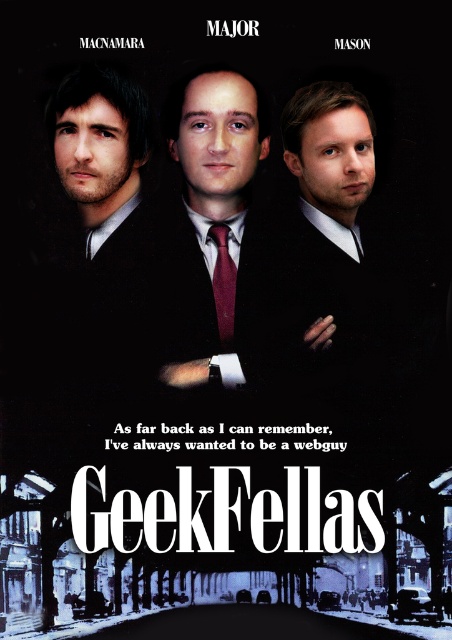
Between matte black suit at center and maroon satin tie at center, which one has more height?

matte black suit at center is taller.

Is matte black suit at center taller than maroon satin tie at center?

Yes.

Where is `matte black suit at center`? The image size is (452, 640). matte black suit at center is located at coordinates (217, 141).